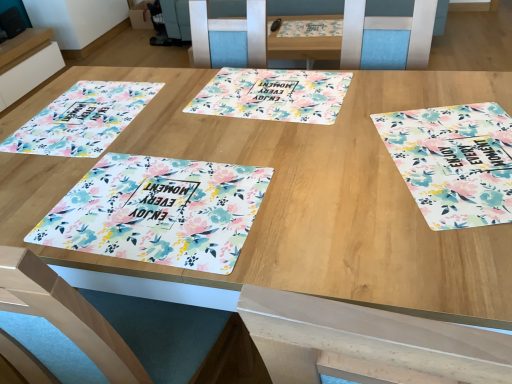
Locate an element on the screen. The image size is (512, 384). free location in front of floral printed placemat at left, acting as the 1th tablecloth starting from the left is located at coordinates (90, 179).